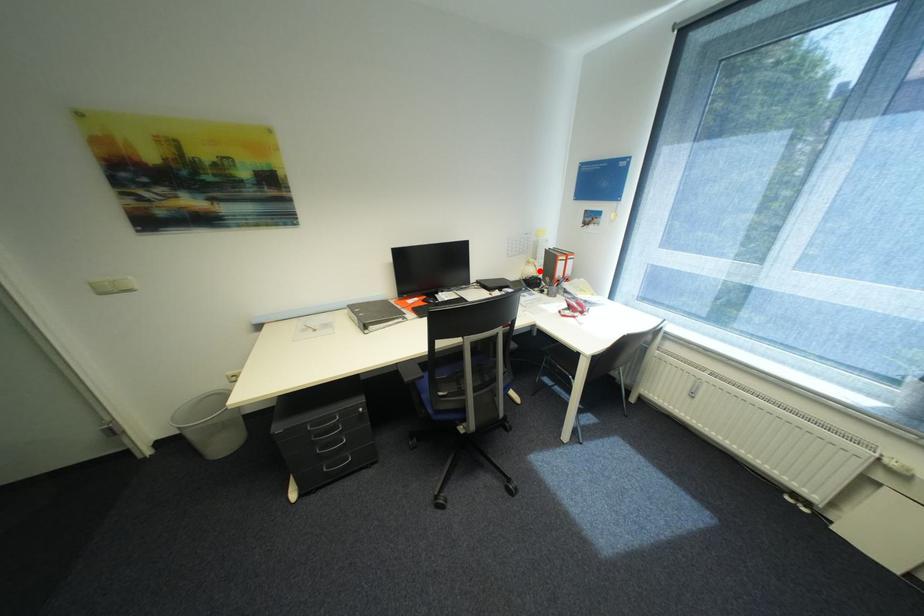
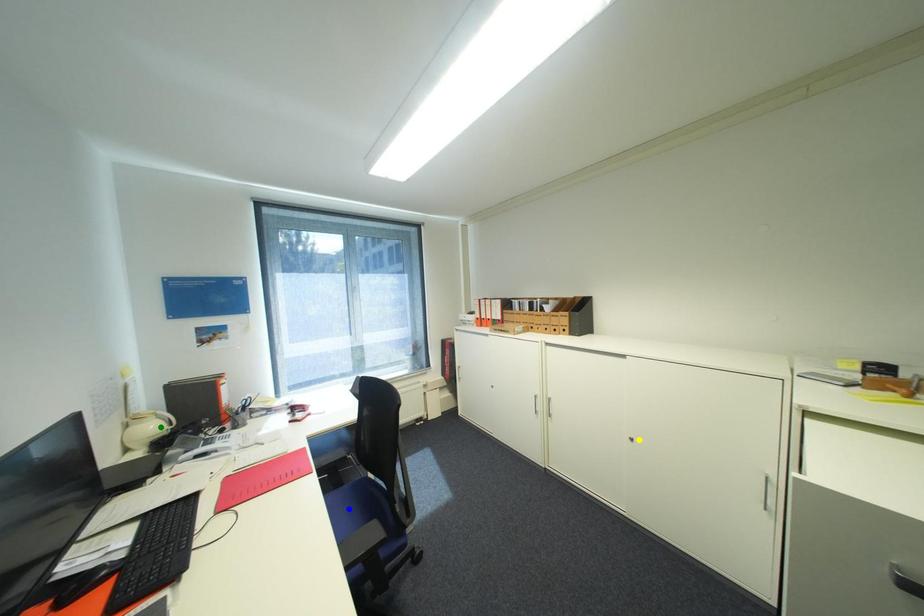
Question: I am providing you with two images of the same scene from different viewpoints. A red point is marked on the first image. You are given multiple points on the second image. Which mark in image 2 goes with the point in image 1?

Choices:
 (A) green point
 (B) blue point
 (C) yellow point

Answer: (A)